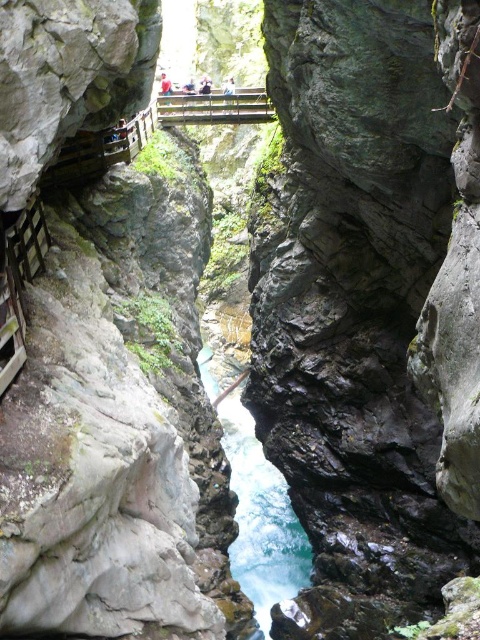
You are standing on the wooden bridge in the canyon and want to locate the blue translucent water at center. Where should you look relative to the bridge?

The blue translucent water at center is located at point 0.811 on the x axis and 0.546 on the y axis relative to the bridge.

You are standing on the wooden bridge in the canyon and want to cross to the other side. As you look down, you notice the blue translucent water at center and the wooden at center. Which object is closer to you as you stand on the bridge?

The blue translucent water at center is closer to you than the wooden at center because the description states that the blue translucent water at center is closer to the viewer than wooden at center.